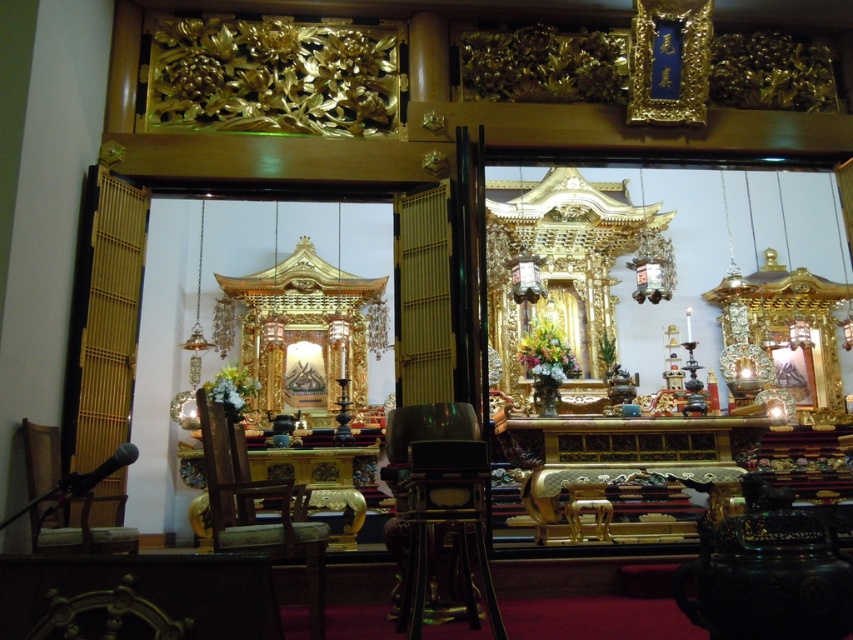
Which is more to the left, metallic gold chair at center or wooden chair at center?

wooden chair at center is more to the left.

Is point (405, 426) less distant than point (228, 534)?

That is False.

Identify the location of metallic gold chair at center. The height and width of the screenshot is (640, 853). (438, 499).

Between metallic gold chair at center and wooden chair at lower left, which one appears on the left side from the viewer's perspective?

wooden chair at lower left

Image resolution: width=853 pixels, height=640 pixels. Describe the element at coordinates (438, 499) in the screenshot. I see `metallic gold chair at center` at that location.

Where is `metallic gold chair at center`? Image resolution: width=853 pixels, height=640 pixels. metallic gold chair at center is located at coordinates (438, 499).

The image size is (853, 640). What do you see at coordinates (65, 502) in the screenshot? I see `wooden chair at lower left` at bounding box center [65, 502].

Is wooden chair at lower left to the right of polished wood chair at lower left from the viewer's perspective?

In fact, wooden chair at lower left is to the left of polished wood chair at lower left.

At what (x,y) coordinates should I click in order to perform the action: click on wooden chair at lower left. Please return your answer as a coordinate pair (x, y). Image resolution: width=853 pixels, height=640 pixels. Looking at the image, I should click on pyautogui.click(x=65, y=502).